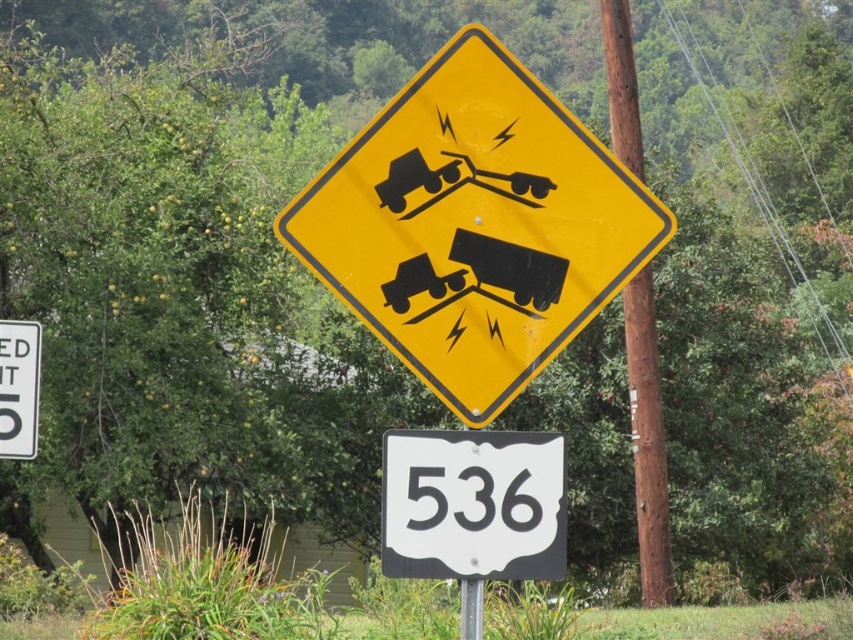
Question: Is yellow reflective diamond-shaped warning sign at center to the right of white plastic speed limit sign at left from the viewer's perspective?

Choices:
 (A) no
 (B) yes

Answer: (B)

Question: Among these objects, which one is nearest to the camera?

Choices:
 (A) white plastic speed limit sign at left
 (B) yellow reflective diamond-shaped warning sign at center

Answer: (B)

Question: Based on their relative distances, which object is farther from the white plastic speed limit sign at left?

Choices:
 (A) white plastic road sign at center
 (B) yellow reflective diamond-shaped warning sign at center

Answer: (A)

Question: In this image, where is white plastic road sign at center located relative to white plastic speed limit sign at left?

Choices:
 (A) left
 (B) right

Answer: (B)

Question: Is white plastic road sign at center thinner than brown wooden pole at center-right?

Choices:
 (A) no
 (B) yes

Answer: (A)

Question: Which point appears farthest from the camera in this image?

Choices:
 (A) (654, 346)
 (B) (4, 336)
 (C) (508, 449)

Answer: (A)